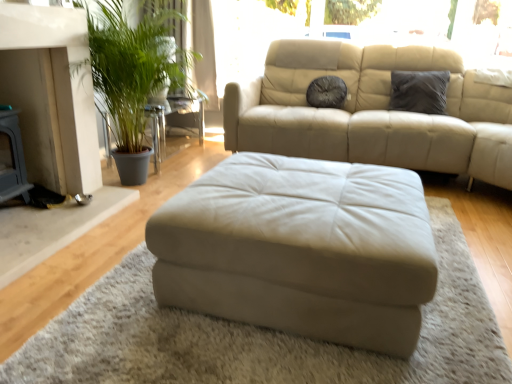
Question: Is point (276, 228) positioned closer to the camera than point (320, 362)?

Choices:
 (A) farther
 (B) closer

Answer: (A)

Question: In terms of width, does beige leather ottoman at center look wider or thinner when compared to beige fabric ottoman at center?

Choices:
 (A) wide
 (B) thin

Answer: (B)

Question: Which is nearer to the beige fabric ottoman at center?

Choices:
 (A) beige leather ottoman at center
 (B) green leafy plant at left
 (C) dark gray fabric pillow at upper right, the first pillow from the right
 (D) dark gray textured pillow at center, the 2th pillow when ordered from right to left

Answer: (A)

Question: Estimate the real-world distances between objects in this image. Which object is closer to the dark gray textured pillow at center, the 2th pillow when ordered from right to left?

Choices:
 (A) dark gray fabric pillow at upper right, which is counted as the second pillow, starting from the left
 (B) beige leather ottoman at center
 (C) beige fabric ottoman at center
 (D) green leafy plant at left

Answer: (A)